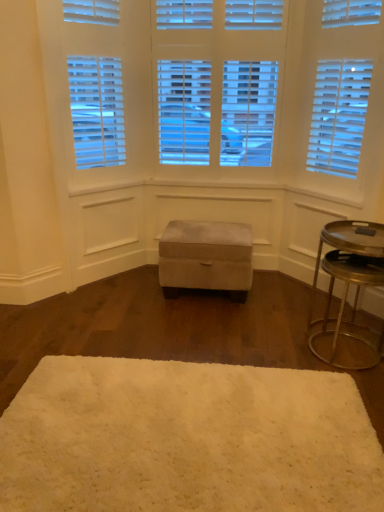
Question: Is suede ottoman at center oriented away from metallic gold tray at right?

Choices:
 (A) yes
 (B) no

Answer: (B)

Question: Does suede ottoman at center have a lesser height compared to metallic gold tray at right?

Choices:
 (A) no
 (B) yes

Answer: (B)

Question: Is suede ottoman at center at the left side of metallic gold tray at right?

Choices:
 (A) yes
 (B) no

Answer: (A)

Question: Is suede ottoman at center closer to the viewer compared to metallic gold tray at right?

Choices:
 (A) no
 (B) yes

Answer: (A)

Question: Is suede ottoman at center placed right next to metallic gold tray at right?

Choices:
 (A) yes
 (B) no

Answer: (B)

Question: Is white fluffy rug at center bigger or smaller than suede ottoman at center?

Choices:
 (A) big
 (B) small

Answer: (B)

Question: Would you say white fluffy rug at center is to the left or to the right of suede ottoman at center in the picture?

Choices:
 (A) left
 (B) right

Answer: (A)

Question: Do you think white fluffy rug at center is within suede ottoman at center, or outside of it?

Choices:
 (A) outside
 (B) inside

Answer: (A)

Question: From the image's perspective, is white fluffy rug at center above or below suede ottoman at center?

Choices:
 (A) below
 (B) above

Answer: (A)

Question: Would you say metallic gold tray at right is to the left or to the right of white fluffy rug at center in the picture?

Choices:
 (A) right
 (B) left

Answer: (A)

Question: In terms of height, does metallic gold tray at right look taller or shorter compared to white fluffy rug at center?

Choices:
 (A) short
 (B) tall

Answer: (B)

Question: From a real-world perspective, is metallic gold tray at right positioned above or below white fluffy rug at center?

Choices:
 (A) above
 (B) below

Answer: (A)

Question: Is metallic gold tray at right in front of or behind white fluffy rug at center in the image?

Choices:
 (A) front
 (B) behind

Answer: (B)

Question: Considering the relative positions of white fluffy rug at center and metallic gold tray at right in the image provided, is white fluffy rug at center to the left or to the right of metallic gold tray at right?

Choices:
 (A) left
 (B) right

Answer: (A)

Question: Is white fluffy rug at center inside or outside of metallic gold tray at right?

Choices:
 (A) inside
 (B) outside

Answer: (B)